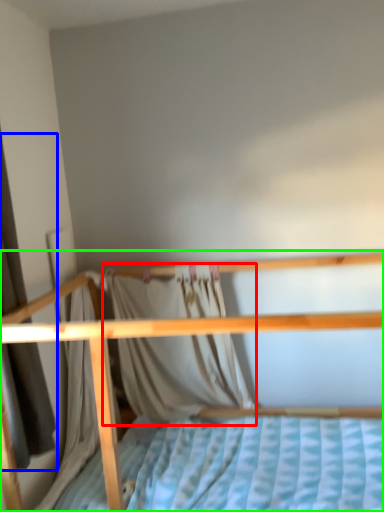
Question: Estimate the real-world distances between objects in this image. Which object is farther from curtain (highlighted by a red box), curtain (highlighted by a blue box) or bed (highlighted by a green box)?

Choices:
 (A) curtain
 (B) bed

Answer: (A)